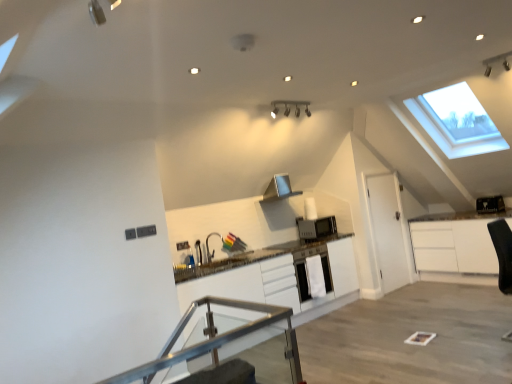
Question: Would you consider black plastic toaster at upper right, which appears as the 1th appliance when viewed from the top, to be distant from transparent glass table at center?

Choices:
 (A) yes
 (B) no

Answer: (A)

Question: From the image's perspective, is black plastic toaster at upper right, which appears as the 1th appliance when viewed from the top, located beneath transparent glass table at center?

Choices:
 (A) yes
 (B) no

Answer: (B)

Question: Are black plastic toaster at upper right, which appears as the 1th appliance when viewed from the top, and transparent glass table at center beside each other?

Choices:
 (A) yes
 (B) no

Answer: (B)

Question: Is black plastic toaster at upper right, which appears as the 1th appliance when viewed from the top, shorter than transparent glass table at center?

Choices:
 (A) no
 (B) yes

Answer: (B)

Question: Does black plastic toaster at upper right, acting as the 2th appliance starting from the bottom, have a larger size compared to transparent glass table at center?

Choices:
 (A) yes
 (B) no

Answer: (B)

Question: Considering the relative sizes of black plastic toaster at upper right, which appears as the 1th appliance when viewed from the top, and transparent glass table at center in the image provided, is black plastic toaster at upper right, which appears as the 1th appliance when viewed from the top, smaller than transparent glass table at center?

Choices:
 (A) yes
 (B) no

Answer: (A)

Question: From the image's perspective, is black plastic toaster at upper right, acting as the 2th appliance starting from the bottom, beneath white matte cabinet at center?

Choices:
 (A) yes
 (B) no

Answer: (B)

Question: From a real-world perspective, is black plastic toaster at upper right, which appears as the 1th appliance when viewed from the top, on white matte cabinet at center?

Choices:
 (A) no
 (B) yes

Answer: (B)

Question: Is black plastic toaster at upper right, the second appliance viewed from the left, shorter than white matte cabinet at center?

Choices:
 (A) yes
 (B) no

Answer: (A)

Question: Is black plastic toaster at upper right, which appears as the 1th appliance when viewed from the top, at the right side of white matte cabinet at center?

Choices:
 (A) yes
 (B) no

Answer: (A)

Question: Is black plastic toaster at upper right, acting as the 2th appliance starting from the bottom, turned away from white matte cabinet at center?

Choices:
 (A) yes
 (B) no

Answer: (B)

Question: Does black plastic toaster at upper right, arranged as the first appliance when viewed from the right, have a greater width compared to white matte cabinet at center?

Choices:
 (A) yes
 (B) no

Answer: (B)

Question: Can you confirm if satin silver microwave at center, the 1th appliance positioned from the left, is thinner than silver metallic exhaust hood at center?

Choices:
 (A) no
 (B) yes

Answer: (B)